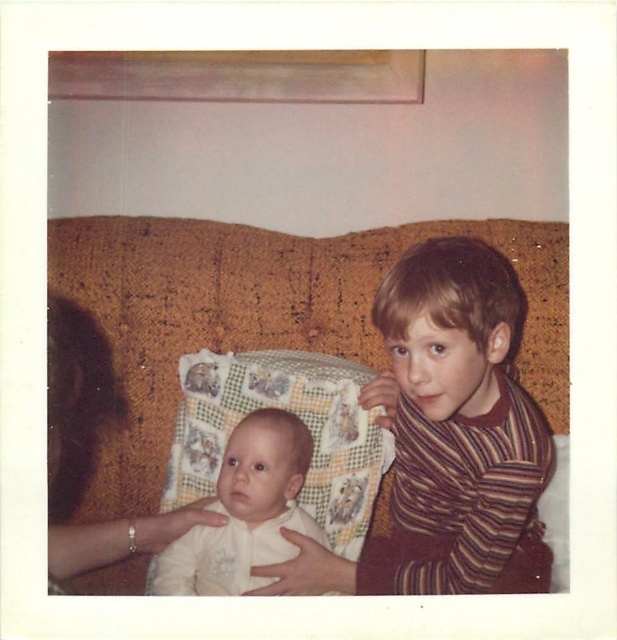
You are standing in front of the vintage family photo. There are two points marked in the image. One is at coordinate point (312, 493) and the other is at point (201, 563). Which point is closer to you?

Point (312, 493) is closer to you because it is further to the camera than point (201, 563).

Consider the image. You are a photographer setting up for a family photo. You notice the brown textured couch at center and the white soft fabric baby at center. Which object is closer to the camera?

The brown textured couch at center is closer to the camera than the white soft fabric baby at center.